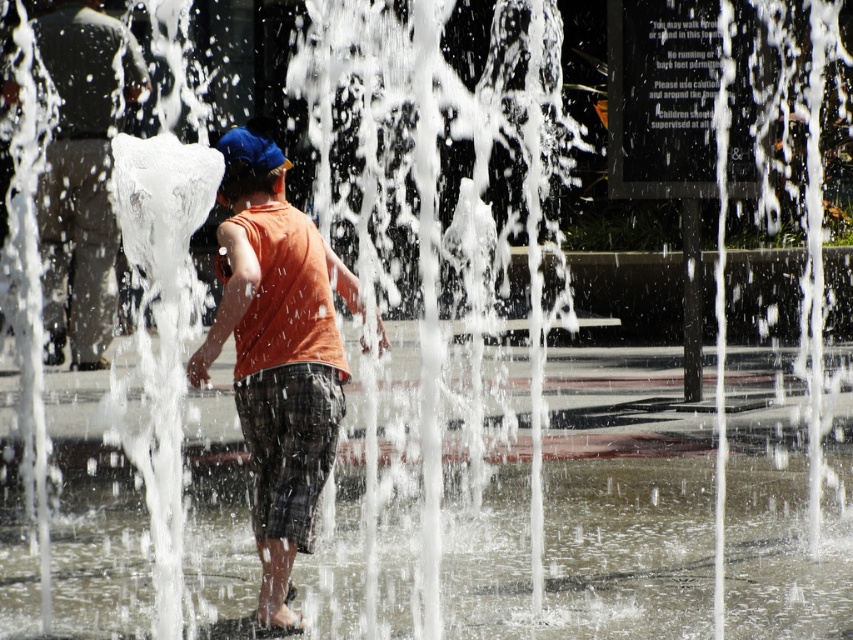
Question: Which object is farther from the camera taking this photo?

Choices:
 (A) orange cotton tank top at center
 (B) orange sleeveless shirt at center

Answer: (B)

Question: Does orange cotton tank top at center appear on the right side of orange sleeveless shirt at center?

Choices:
 (A) yes
 (B) no

Answer: (A)

Question: Among these points, which one is nearest to the camera?

Choices:
 (A) (85, 48)
 (B) (242, 410)

Answer: (B)

Question: Does orange cotton tank top at center lie in front of orange sleeveless shirt at center?

Choices:
 (A) no
 (B) yes

Answer: (B)

Question: Observing the image, what is the correct spatial positioning of orange cotton tank top at center in reference to orange sleeveless shirt at center?

Choices:
 (A) left
 (B) right

Answer: (B)